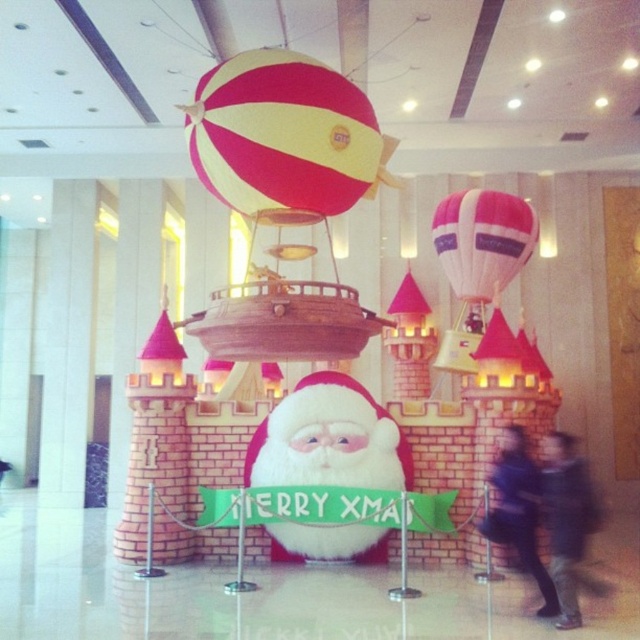
Is point (304, 426) behind point (484, 209)?

That is False.

The height and width of the screenshot is (640, 640). Find the location of `fluffy white santa at center`. fluffy white santa at center is located at coordinates (328, 438).

Locate an element on the screen. The width and height of the screenshot is (640, 640). pink fabric balloon at center is located at coordinates (483, 241).

Who is more distant from viewer, (502,225) or (506,506)?

The point (502,225) is behind.

The image size is (640, 640). I want to click on pink fabric balloon at center, so click(483, 241).

Between point (564, 449) and point (492, 540), which one is positioned in front?

Point (492, 540) is more forward.

Does dark blue jacket at lower right lie in front of dark blue fabric coat at lower right?

Yes, it is in front of dark blue fabric coat at lower right.

Does point (572, 531) come closer to viewer compared to point (528, 524)?

That is True.

Identify the location of dark blue jacket at lower right. (568, 524).